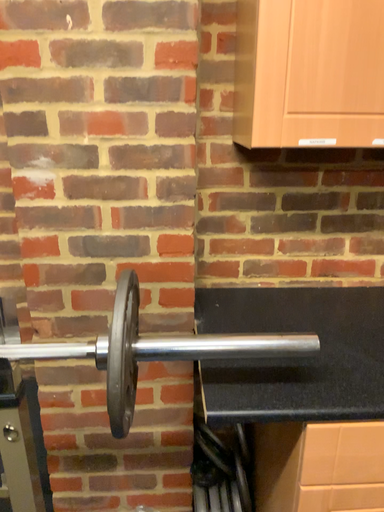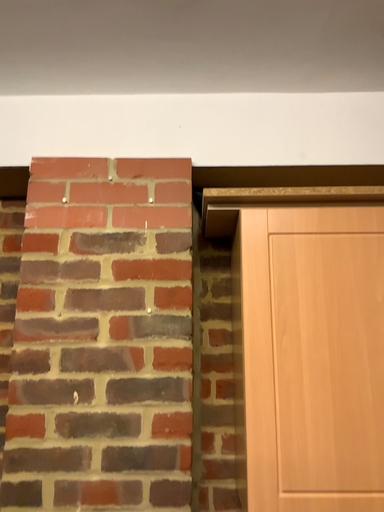
Question: Which way did the camera rotate in the video?

Choices:
 (A) rotated upward
 (B) rotated downward

Answer: (A)